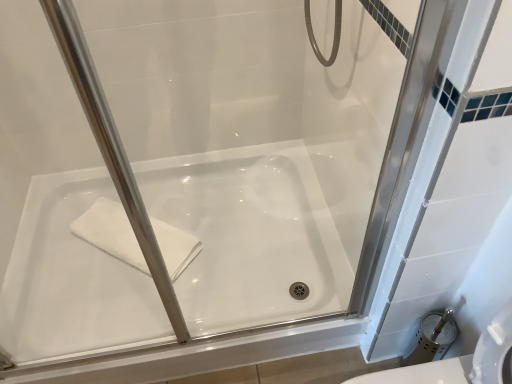
This screenshot has width=512, height=384. I want to click on free space above white soft towel at lower left (from a real-world perspective), so click(x=116, y=230).